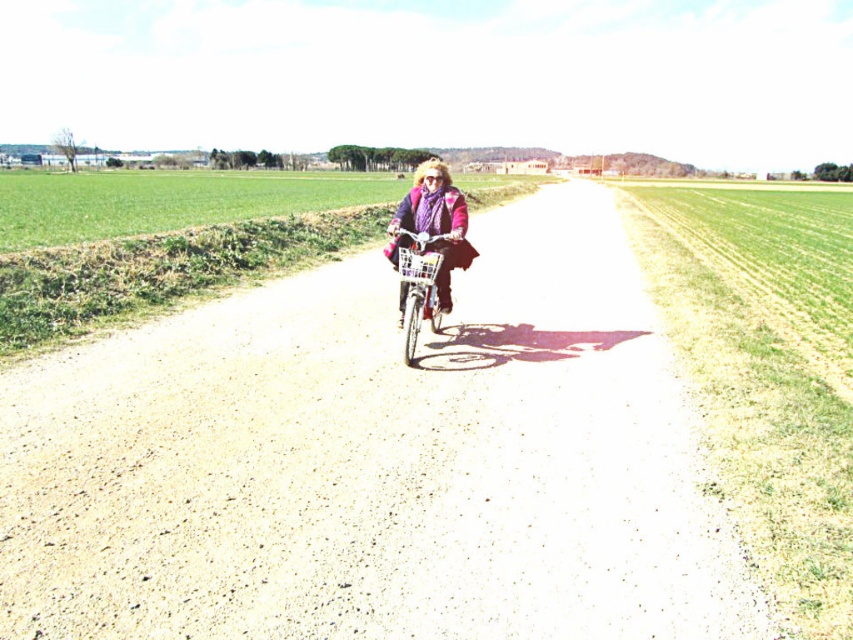
Question: Can you confirm if matte purple sweater at center is positioned to the left of metallic silver bicycle at center?

Choices:
 (A) no
 (B) yes

Answer: (B)

Question: Is gravel road at center thinner than matte purple sweater at center?

Choices:
 (A) yes
 (B) no

Answer: (B)

Question: Which point is closer to the camera?

Choices:
 (A) (401, 248)
 (B) (445, 193)

Answer: (A)

Question: Can you confirm if gravel road at center is smaller than metallic silver bicycle at center?

Choices:
 (A) yes
 (B) no

Answer: (B)

Question: Which of the following is the farthest from the observer?

Choices:
 (A) metallic silver bicycle at center
 (B) matte purple sweater at center

Answer: (B)

Question: Which point is farther from the camera taking this photo?

Choices:
 (A) (409, 314)
 (B) (440, 204)

Answer: (B)